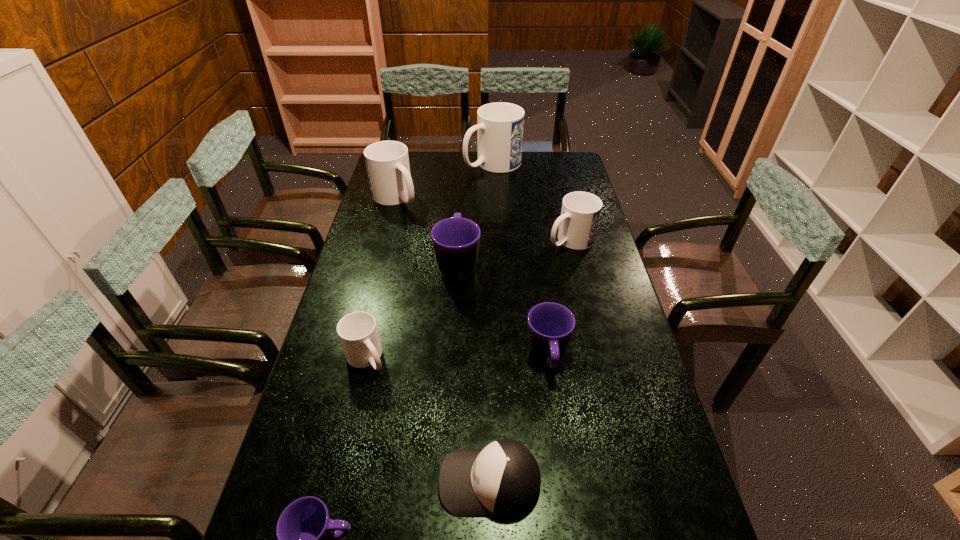
Identify the location of free space located 0.250m on the front panel of the cap. (329, 482).

Locate an element on the screen. Image resolution: width=960 pixels, height=540 pixels. vacant space situated 0.170m on the front panel of the cap is located at coordinates (365, 482).

I want to click on vacant space located 0.220m on the front panel of the cap, so click(343, 482).

Where is `object that is at the far edge`? This screenshot has height=540, width=960. object that is at the far edge is located at coordinates (500, 125).

The image size is (960, 540). What are the coordinates of `object located at the right edge` in the screenshot? It's located at (580, 213).

You are a GUI agent. You are given a task and a screenshot of the screen. Output one action in this format:
    pyautogui.click(x=<x>, y=<y>)
    Task: Click on the vacant space at the far edge of the desktop
    This screenshot has height=540, width=960.
    Given the screenshot: What is the action you would take?
    pyautogui.click(x=498, y=174)

Where is `vacant space at the left edge`? This screenshot has width=960, height=540. vacant space at the left edge is located at coordinates (390, 233).

Identify the location of free space at the right edge of the desktop. (607, 262).

Where is `free region at the far right corner of the desktop`? free region at the far right corner of the desktop is located at coordinates (555, 164).

The width and height of the screenshot is (960, 540). In order to click on vacant area that lies between the biggest black mug and the gray cap in this screenshot , I will do `click(474, 373)`.